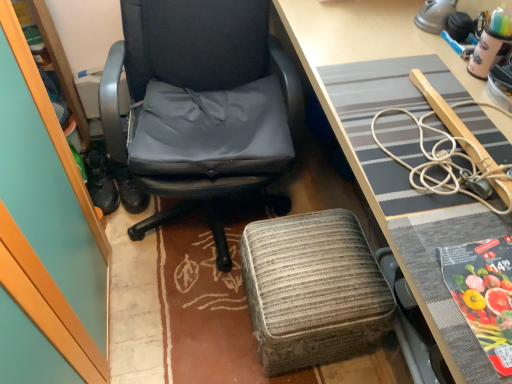
Question: Is woven fabric stool at lower center positioned far away from printed paper at lower right?

Choices:
 (A) no
 (B) yes

Answer: (A)

Question: Does woven fabric stool at lower center appear on the right side of printed paper at lower right?

Choices:
 (A) no
 (B) yes

Answer: (A)

Question: Can you confirm if woven fabric stool at lower center is thinner than printed paper at lower right?

Choices:
 (A) no
 (B) yes

Answer: (A)

Question: From the image's perspective, is woven fabric stool at lower center located above printed paper at lower right?

Choices:
 (A) yes
 (B) no

Answer: (B)

Question: Is woven fabric stool at lower center placed right next to printed paper at lower right?

Choices:
 (A) no
 (B) yes

Answer: (A)

Question: Considering the relative positions of woven fabric stool at lower center and printed paper at lower right in the image provided, is woven fabric stool at lower center to the left of printed paper at lower right from the viewer's perspective?

Choices:
 (A) no
 (B) yes

Answer: (B)

Question: Does black rubber shoes at left have a smaller size compared to printed paper at lower right?

Choices:
 (A) yes
 (B) no

Answer: (B)

Question: Is black rubber shoes at left oriented towards printed paper at lower right?

Choices:
 (A) yes
 (B) no

Answer: (B)

Question: Can you confirm if black rubber shoes at left is positioned to the right of printed paper at lower right?

Choices:
 (A) yes
 (B) no

Answer: (B)

Question: Is printed paper at lower right at the back of black rubber shoes at left?

Choices:
 (A) no
 (B) yes

Answer: (A)

Question: Is black rubber shoes at left not close to printed paper at lower right?

Choices:
 (A) yes
 (B) no

Answer: (A)

Question: From the image's perspective, is black rubber shoes at left over printed paper at lower right?

Choices:
 (A) no
 (B) yes

Answer: (B)

Question: From the image's perspective, does textured gray desk mat at center appear higher than black rubber shoes at left?

Choices:
 (A) no
 (B) yes

Answer: (B)